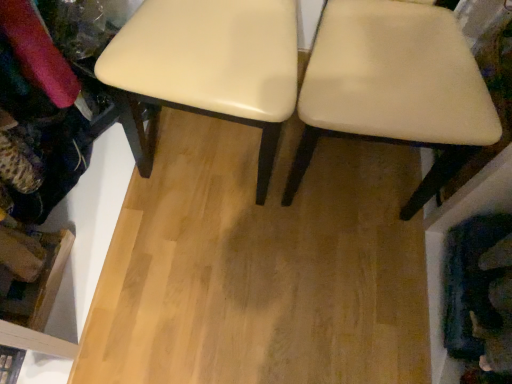
Question: Is beige fabric chair at center not inside matte cream stool at center?

Choices:
 (A) yes
 (B) no

Answer: (A)

Question: Is beige fabric chair at center facing towards matte cream stool at center?

Choices:
 (A) no
 (B) yes

Answer: (A)

Question: Is beige fabric chair at center thinner than matte cream stool at center?

Choices:
 (A) no
 (B) yes

Answer: (B)

Question: From the image's perspective, is beige fabric chair at center located above matte cream stool at center?

Choices:
 (A) yes
 (B) no

Answer: (B)

Question: Is beige fabric chair at center further to the viewer compared to matte cream stool at center?

Choices:
 (A) no
 (B) yes

Answer: (A)

Question: Is matte cream stool at center completely or partially inside beige fabric chair at center?

Choices:
 (A) no
 (B) yes

Answer: (A)

Question: From the image's perspective, is matte cream stool at center over beige fabric chair at center?

Choices:
 (A) yes
 (B) no

Answer: (A)

Question: Considering the relative sizes of matte cream stool at center and beige fabric chair at center in the image provided, is matte cream stool at center taller than beige fabric chair at center?

Choices:
 (A) no
 (B) yes

Answer: (A)

Question: From the image's perspective, is matte cream stool at center below beige fabric chair at center?

Choices:
 (A) no
 (B) yes

Answer: (A)

Question: Is matte cream stool at center next to beige fabric chair at center?

Choices:
 (A) yes
 (B) no

Answer: (B)

Question: Is beige fabric chair at center located within matte cream stool at center?

Choices:
 (A) no
 (B) yes

Answer: (A)

Question: Is the position of matte cream stool at center less distant than that of beige fabric chair at center?

Choices:
 (A) yes
 (B) no

Answer: (B)

Question: Considering the positions of beige fabric chair at center and matte cream stool at center in the image, is beige fabric chair at center taller or shorter than matte cream stool at center?

Choices:
 (A) tall
 (B) short

Answer: (A)